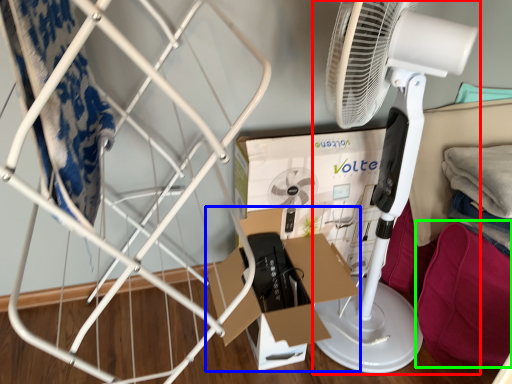
Question: Based on their relative distances, which object is farther from mechanical fan (highlighted by a red box)? Choose from cardboard box (highlighted by a blue box) and clothing (highlighted by a green box).

Choices:
 (A) cardboard box
 (B) clothing

Answer: (A)